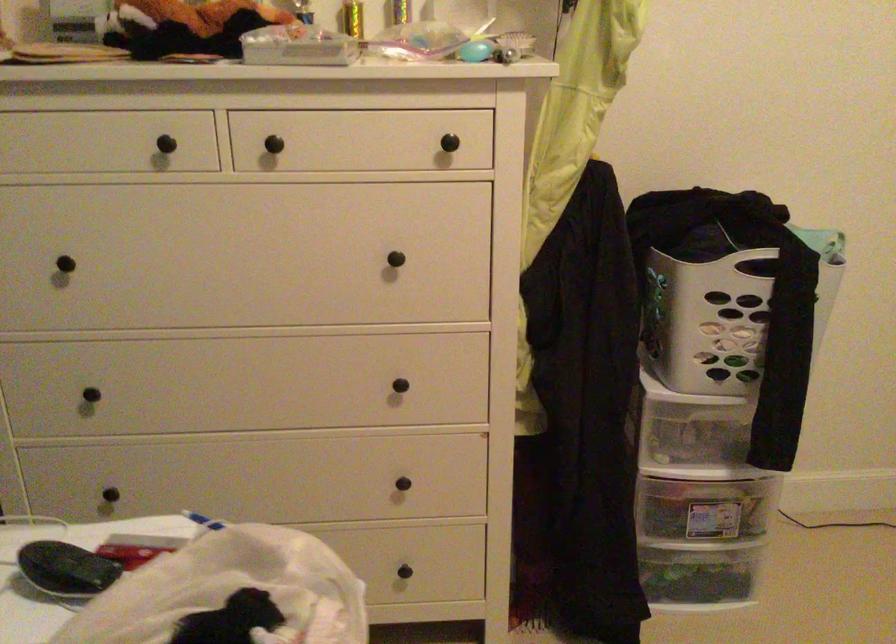
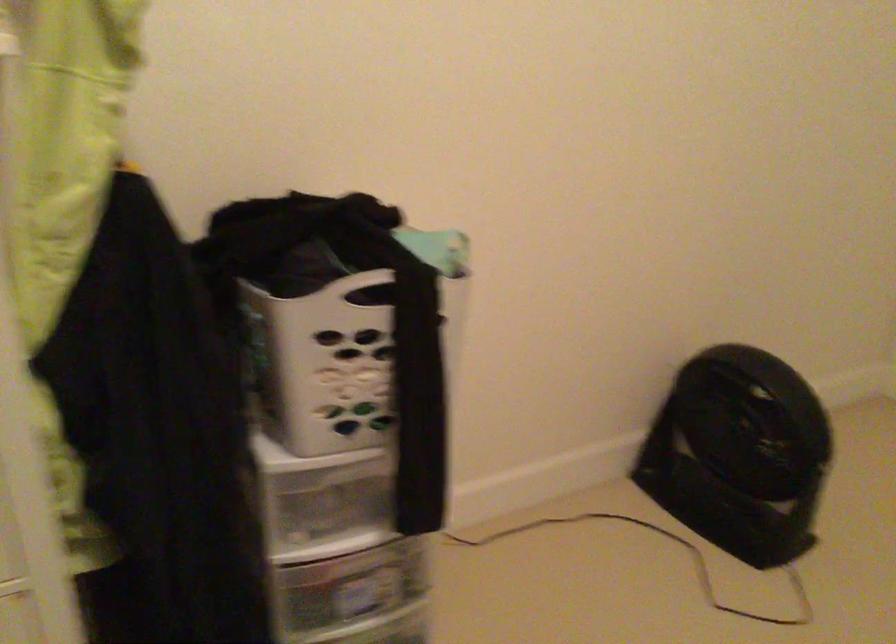
Which direction would the cameraman need to move to produce the second image?

The movement direction of the cameraman is right, forward.